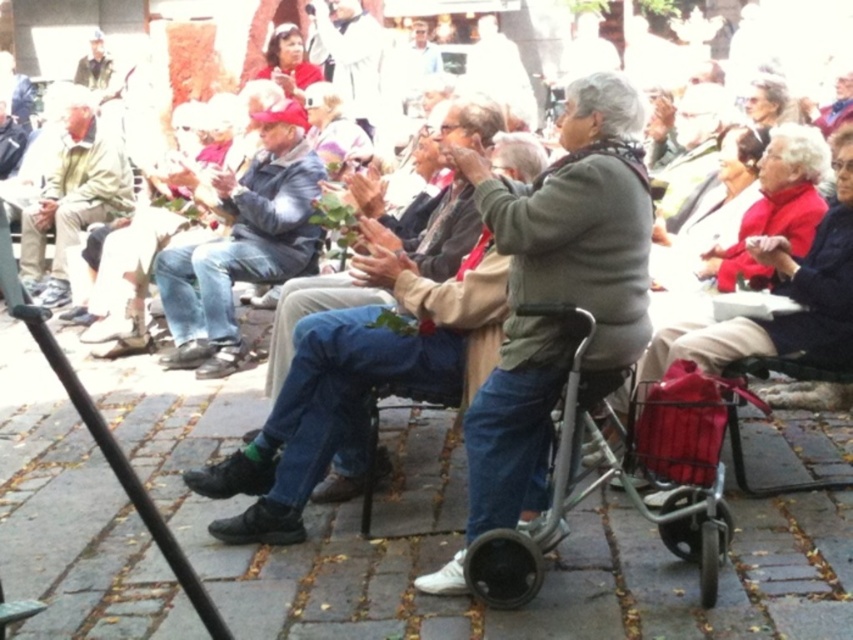
Question: Considering the real-world distances, which object is closest to the denim jeans at center?

Choices:
 (A) metallic black walker at lower left
 (B) khaki cotton pants at left
 (C) metallic gray walker at center
 (D) denim jacket at center

Answer: (C)

Question: Can you confirm if denim jeans at center is positioned below metallic gray walker at center?

Choices:
 (A) no
 (B) yes

Answer: (A)

Question: From the image, what is the correct spatial relationship of metallic gray walker at center in relation to denim jacket at center?

Choices:
 (A) below
 (B) above

Answer: (A)

Question: Among these objects, which one is nearest to the camera?

Choices:
 (A) denim jeans at center
 (B) denim jacket at center
 (C) metallic black walker at lower left
 (D) metallic gray walker at center

Answer: (C)

Question: Estimate the real-world distances between objects in this image. Which object is closer to the khaki cotton pants at left?

Choices:
 (A) metallic gray walker at center
 (B) metallic black walker at lower left

Answer: (B)

Question: Is denim jeans at center below denim jacket at center?

Choices:
 (A) yes
 (B) no

Answer: (A)